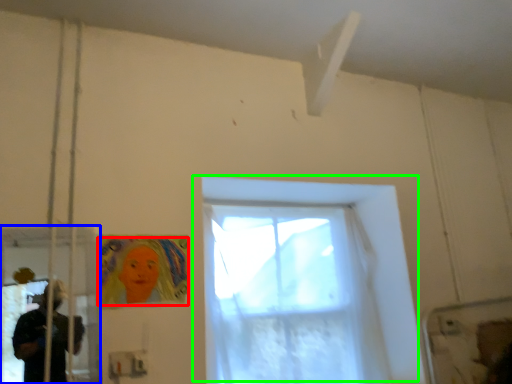
Question: Which object is the closest to the woman (highlighted by a red box)? Choose among these: screen door (highlighted by a blue box) or window (highlighted by a green box).

Choices:
 (A) screen door
 (B) window

Answer: (A)